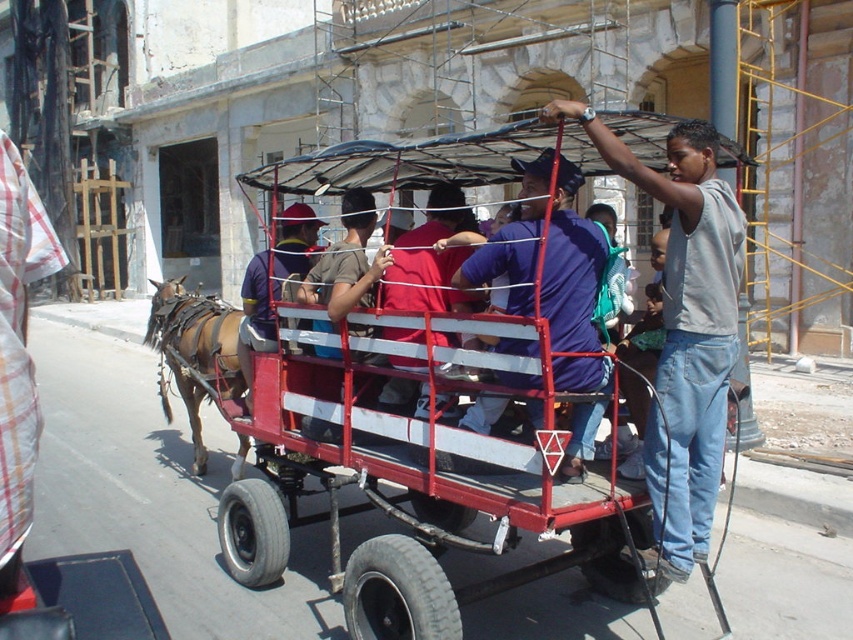
Question: Which of the following is the farthest from the observer?

Choices:
 (A) brushed metal helmet at center
 (B) metallic red cart at center
 (C) blue denim shirt at center

Answer: (A)

Question: Which object is farther from the camera taking this photo?

Choices:
 (A) blue denim shirt at center
 (B) red fabric shirt at center
 (C) metallic red cart at center
 (D) brushed metal helmet at center

Answer: (D)

Question: Considering the relative positions of blue denim shirt at center and brown leather harness at left in the image provided, where is blue denim shirt at center located with respect to brown leather harness at left?

Choices:
 (A) below
 (B) above

Answer: (B)

Question: Can you confirm if blue denim shirt at center is positioned below red fabric shirt at center?

Choices:
 (A) yes
 (B) no

Answer: (A)

Question: Which point is farther to the camera?

Choices:
 (A) brown leather harness at left
 (B) gray cotton shirt at upper right
 (C) blue denim shirt at center

Answer: (A)

Question: Is metallic red cart at center to the left of red fabric shirt at center from the viewer's perspective?

Choices:
 (A) yes
 (B) no

Answer: (A)